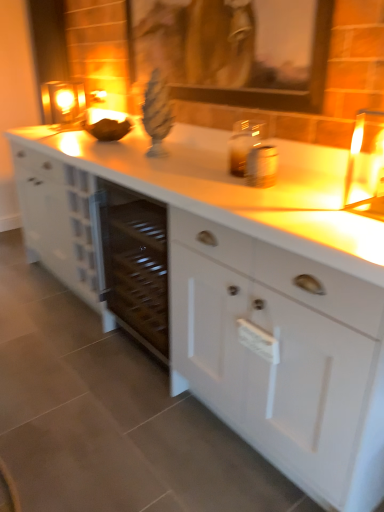
Question: Is white matte cabinet at center to the right of matte glass candle at upper left from the viewer's perspective?

Choices:
 (A) no
 (B) yes

Answer: (B)

Question: Is white matte cabinet at center thinner than matte glass candle at upper left?

Choices:
 (A) yes
 (B) no

Answer: (B)

Question: From a real-world perspective, does white matte cabinet at center stand above matte glass candle at upper left?

Choices:
 (A) no
 (B) yes

Answer: (A)

Question: Is the position of white matte cabinet at center more distant than that of matte glass candle at upper left?

Choices:
 (A) yes
 (B) no

Answer: (B)

Question: Is white matte cabinet at center oriented towards matte glass candle at upper left?

Choices:
 (A) no
 (B) yes

Answer: (A)

Question: From a real-world perspective, is wooden picture frame at upper center physically located above or below matte glass candle at upper left?

Choices:
 (A) below
 (B) above

Answer: (B)

Question: Is wooden picture frame at upper center to the left or to the right of matte glass candle at upper left in the image?

Choices:
 (A) right
 (B) left

Answer: (A)

Question: Considering their positions, is wooden picture frame at upper center located in front of or behind matte glass candle at upper left?

Choices:
 (A) behind
 (B) front

Answer: (B)

Question: Do you think wooden picture frame at upper center is within matte glass candle at upper left, or outside of it?

Choices:
 (A) inside
 (B) outside

Answer: (B)

Question: From the image's perspective, is white matte cabinet at center located above or below matte glass candle at upper left?

Choices:
 (A) below
 (B) above

Answer: (A)

Question: Is white matte cabinet at center bigger or smaller than matte glass candle at upper left?

Choices:
 (A) small
 (B) big

Answer: (B)

Question: Based on their positions, is white matte cabinet at center located to the left or right of matte glass candle at upper left?

Choices:
 (A) left
 (B) right

Answer: (B)

Question: Considering their positions, is white matte cabinet at center located in front of or behind matte glass candle at upper left?

Choices:
 (A) behind
 (B) front

Answer: (B)

Question: In terms of width, does white matte cabinet at center look wider or thinner when compared to wooden picture frame at upper center?

Choices:
 (A) wide
 (B) thin

Answer: (A)

Question: Is point (357, 366) closer or farther from the camera than point (284, 105)?

Choices:
 (A) farther
 (B) closer

Answer: (B)